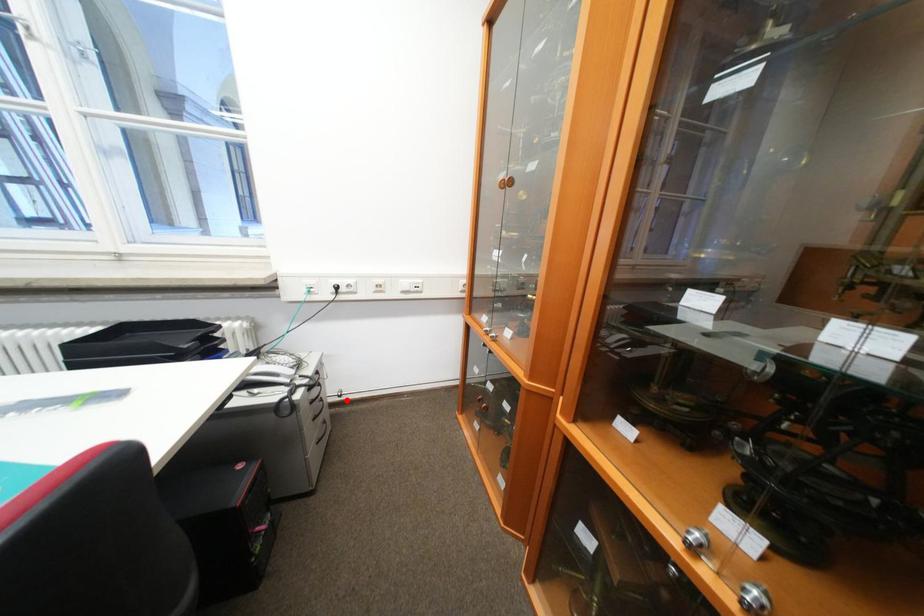
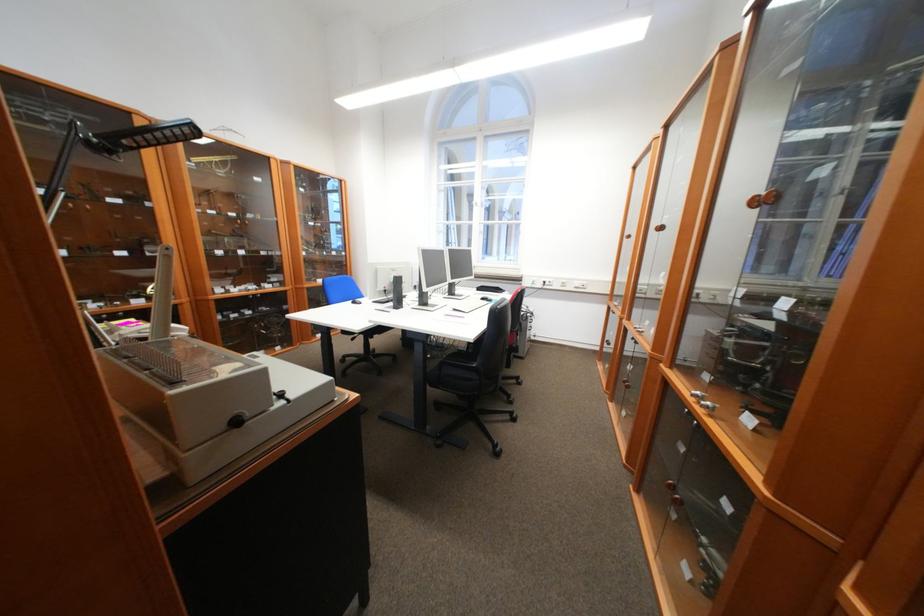
Question: I am providing you with two images of the same scene from different viewpoints. A red point is shown in image1. For the corresponding object point in image2, is it positioned nearer or farther from the camera?

Choices:
 (A) Nearer
 (B) Farther

Answer: (B)